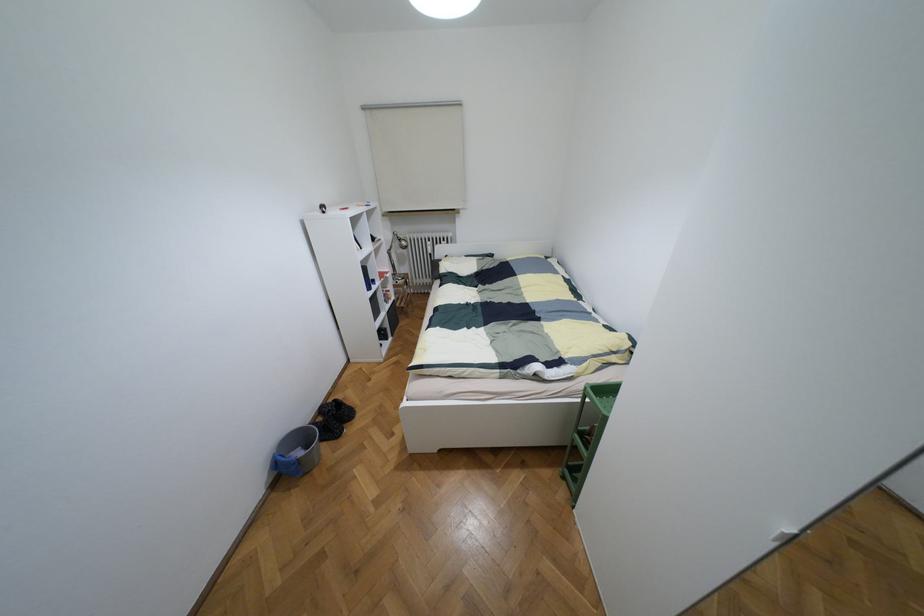
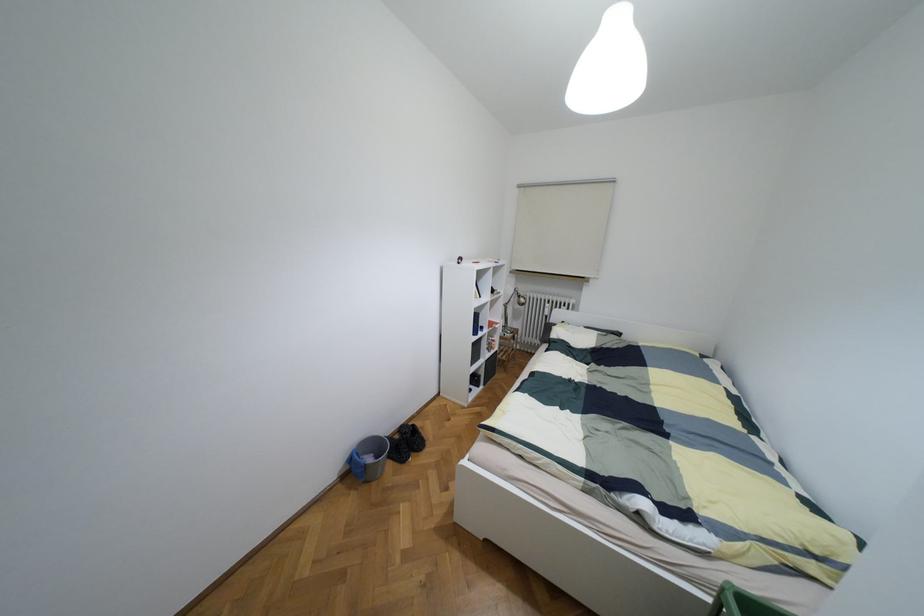
Locate, in the second image, the point that corresponds to pixel 298 453 in the first image.

(369, 459)